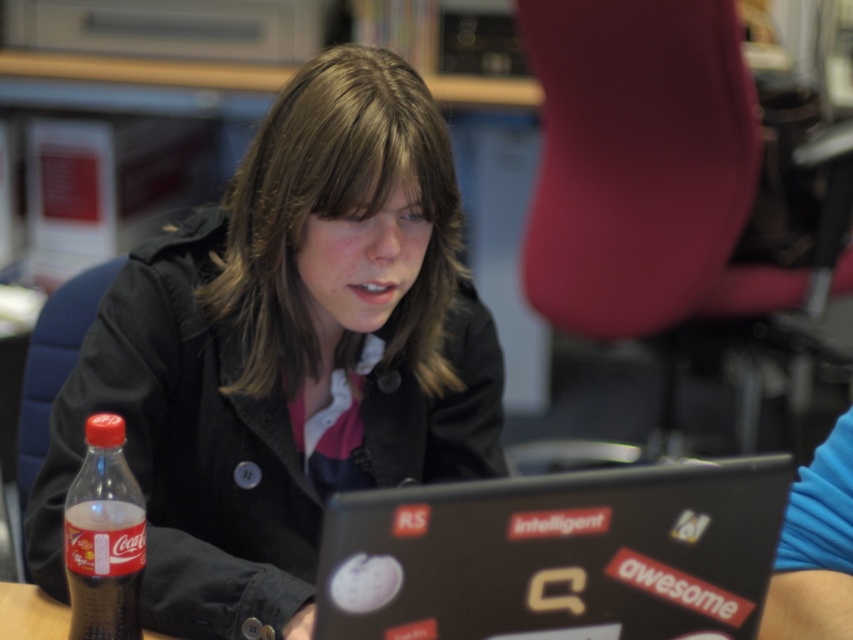
You are standing in the office and want to place a small plant between the two points, point (50, 451) and point (115, 502). Which point should the plant be closer to in order to be closer to the viewer?

The plant should be closer to point (50, 451) because it is further to the viewer than point (115, 502).

You are organizing items on a desk and need to place the black matte jacket at center and the translucent plastic bottle at lower left into boxes. The box for larger items is 30 cm wide, and the smaller box is 20 cm wide. Which item goes into which box?

The black matte jacket at center is larger in size than the translucent plastic bottle at lower left, so the black matte jacket at center should go into the 30 cm wide box, and the translucent plastic bottle at lower left should go into the 20 cm wide box.

You are organizing a small party and need to place a 15 cm tall cake on the desk. The translucent plastic bottle at lower left and brown wooden table at lower left are both on the desk. Is there enough space between them to place the cake without moving either item?

The translucent plastic bottle at lower left is 13.57 centimeters away from the brown wooden table at lower left. Since the cake is 15 cm tall, the vertical distance between the items is insufficient to accommodate the cake vertically. Therefore, the cake cannot be placed between them without moving either item.